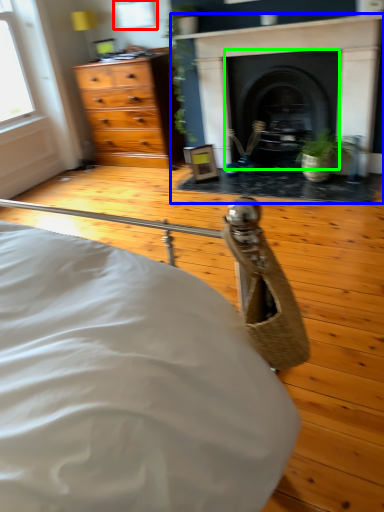
Question: Which is farther away from window (highlighted by a red box)? fireplace (highlighted by a blue box) or fireplace (highlighted by a green box)?

Choices:
 (A) fireplace
 (B) fireplace

Answer: (B)